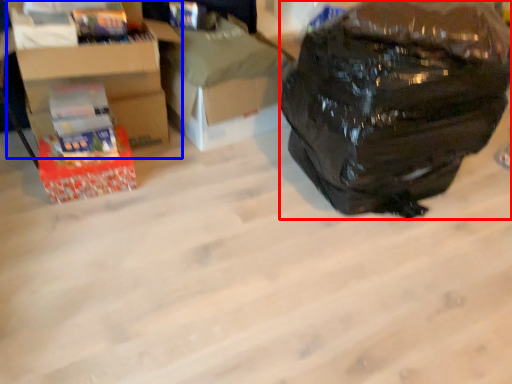
Question: Which object is further to the camera taking this photo, backpack (highlighted by a red box) or cardboard box (highlighted by a blue box)?

Choices:
 (A) backpack
 (B) cardboard box

Answer: (B)